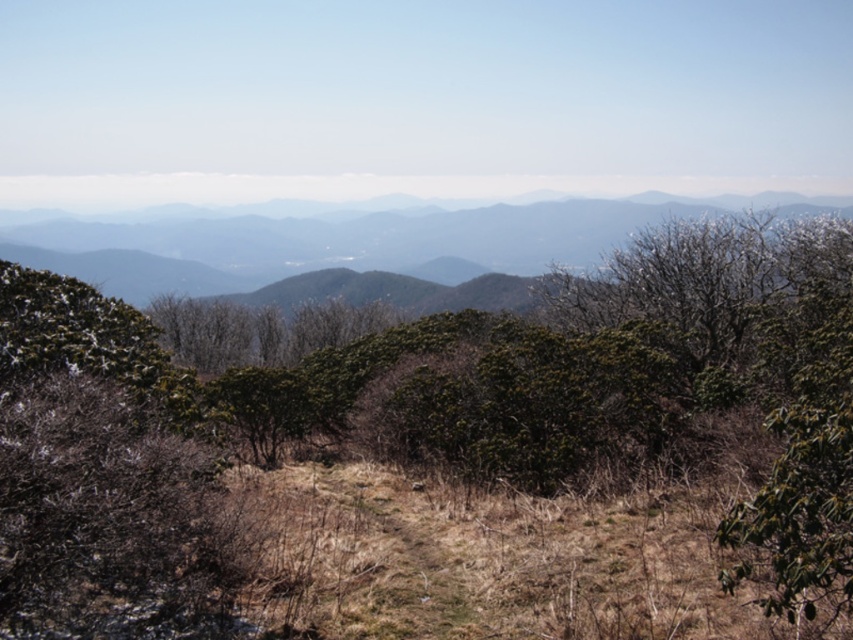
Is green leafy bush at center behind grayish-brown rocky mountain at center?

No, it is in front of grayish-brown rocky mountain at center.

Can you confirm if green leafy bush at center is positioned to the right of grayish-brown rocky mountain at center?

Yes, green leafy bush at center is to the right of grayish-brown rocky mountain at center.

Who is more distant from viewer, (498,316) or (582,250)?

The point (582,250) is more distant.

Where is `green leafy bush at center`? This screenshot has width=853, height=640. green leafy bush at center is located at coordinates (433, 445).